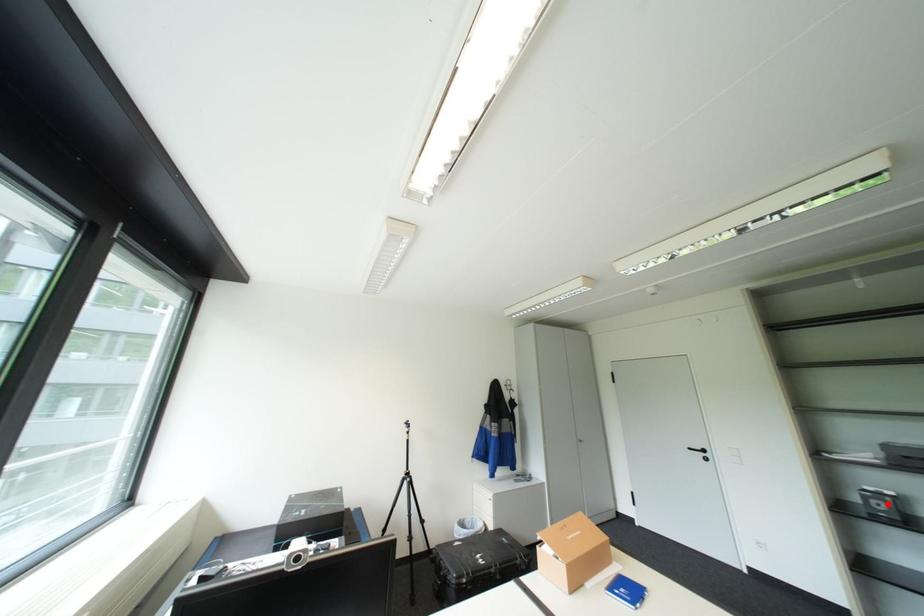
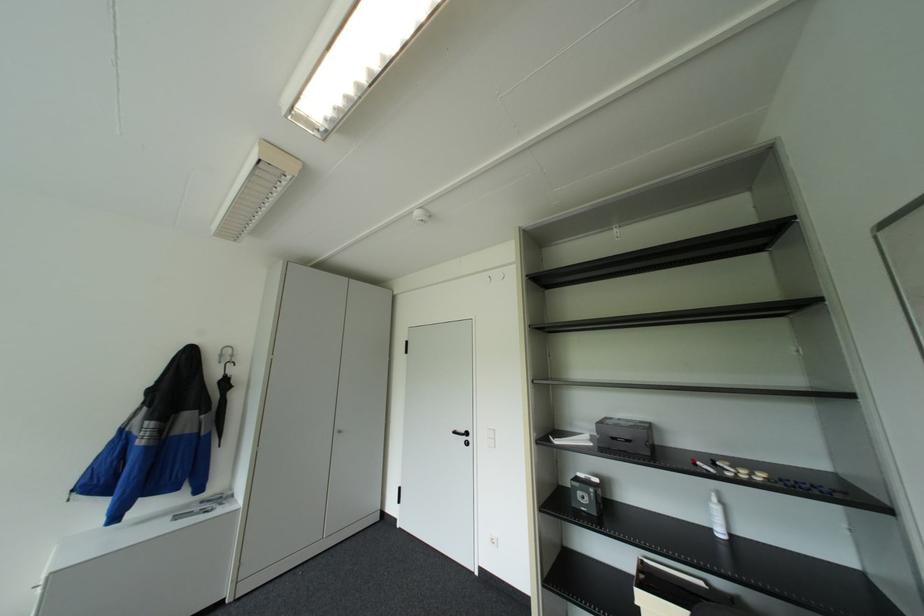
The point at the highlighted location is marked in the first image. Where is the corresponding point in the second image?

(591, 496)